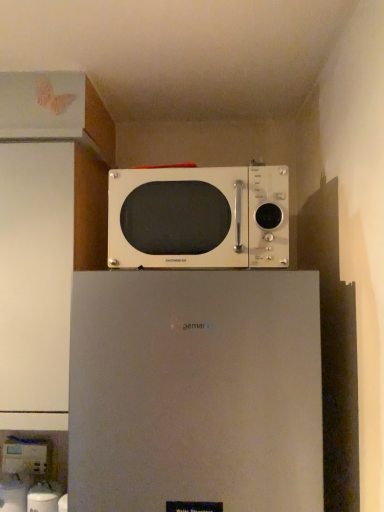
Question: Does satin white refrigerator at upper center come behind white glossy water dispenser at lower left, marked as the second appliance in a left-to-right arrangement?

Choices:
 (A) no
 (B) yes

Answer: (A)

Question: Can you see satin white refrigerator at upper center touching white glossy water dispenser at lower left, which appears as the 2th appliance when viewed from the back?

Choices:
 (A) yes
 (B) no

Answer: (B)

Question: From the image's perspective, is satin white refrigerator at upper center over white glossy water dispenser at lower left, the first appliance positioned from the bottom?

Choices:
 (A) no
 (B) yes

Answer: (B)

Question: From a real-world perspective, does satin white refrigerator at upper center sit lower than white glossy water dispenser at lower left, which appears as the 2th appliance when viewed from the back?

Choices:
 (A) no
 (B) yes

Answer: (A)

Question: Considering the relative positions of satin white refrigerator at upper center and white glossy water dispenser at lower left, the second appliance in the top-to-bottom sequence, in the image provided, is satin white refrigerator at upper center to the right of white glossy water dispenser at lower left, the second appliance in the top-to-bottom sequence, from the viewer's perspective?

Choices:
 (A) no
 (B) yes

Answer: (B)

Question: From the image's perspective, is satin white refrigerator at upper center located above or below white glossy water dispenser at lower left, marked as the second appliance in a left-to-right arrangement?

Choices:
 (A) above
 (B) below

Answer: (A)

Question: Relative to white glossy water dispenser at lower left, marked as the second appliance in a left-to-right arrangement, is satin white refrigerator at upper center in front or behind?

Choices:
 (A) behind
 (B) front

Answer: (B)

Question: Is point (72, 432) closer or farther from the camera than point (56, 507)?

Choices:
 (A) farther
 (B) closer

Answer: (B)

Question: Visually, is satin white refrigerator at upper center positioned to the left or to the right of white glossy water dispenser at lower left, the 1th appliance positioned from the front?

Choices:
 (A) left
 (B) right

Answer: (B)

Question: Is satin white refrigerator at upper center bigger or smaller than white plastic water dispenser at lower left, marked as the 1th appliance in a back-to-front arrangement?

Choices:
 (A) big
 (B) small

Answer: (A)

Question: From a real-world perspective, is satin white refrigerator at upper center above or below white plastic water dispenser at lower left, marked as the 1th appliance in a back-to-front arrangement?

Choices:
 (A) below
 (B) above

Answer: (B)

Question: Is point (170, 428) positioned closer to the camera than point (31, 465)?

Choices:
 (A) farther
 (B) closer

Answer: (B)

Question: In the image, is satin white refrigerator at upper center positioned in front of or behind white plastic water dispenser at lower left, placed as the 2th appliance when sorted from right to left?

Choices:
 (A) behind
 (B) front

Answer: (B)

Question: From a real-world perspective, relative to white glossy water dispenser at lower left, which appears as the 2th appliance when viewed from the back, is white plastic water dispenser at lower left, which appears as the first appliance when viewed from the top, vertically above or below?

Choices:
 (A) above
 (B) below

Answer: (A)

Question: From the image's perspective, relative to white glossy water dispenser at lower left, the second appliance in the top-to-bottom sequence, is white plastic water dispenser at lower left, which appears as the first appliance when viewed from the top, above or below?

Choices:
 (A) below
 (B) above

Answer: (B)